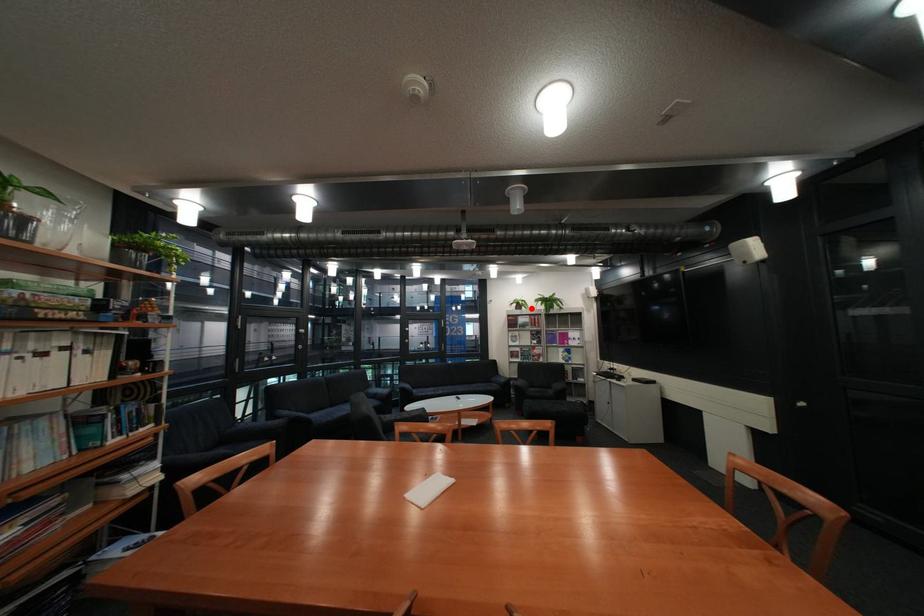
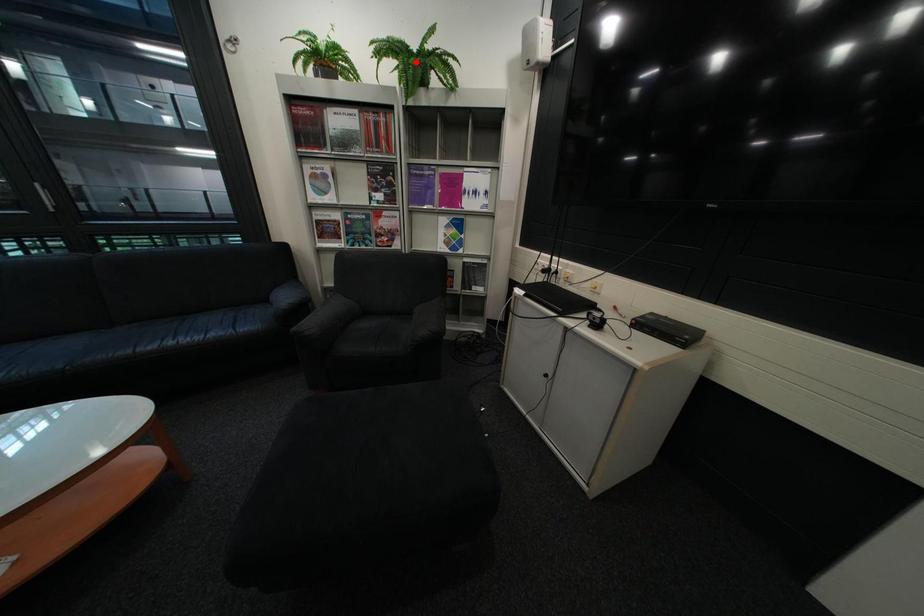
I am providing you with two images of the same scene from different viewpoints. A red point is marked on the first image and another point is marked on the second image. Is the marked point in image1 the same physical position as the marked point in image2?

No